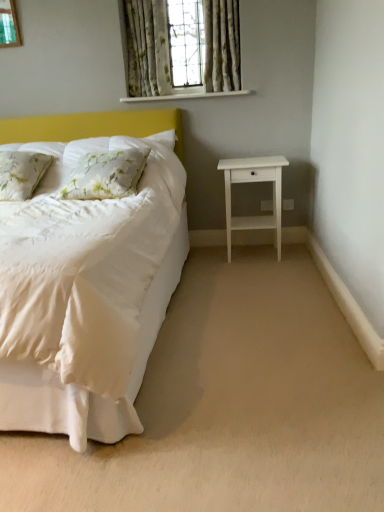
Question: Does floral fabric pillow at left, the first pillow positioned from the left, have a greater height compared to floral fabric pillow at left, marked as the second pillow in a left-to-right arrangement?

Choices:
 (A) no
 (B) yes

Answer: (B)

Question: From the image's perspective, is floral fabric pillow at left, marked as the 2th pillow in a right-to-left arrangement, below floral fabric pillow at left, marked as the second pillow in a left-to-right arrangement?

Choices:
 (A) no
 (B) yes

Answer: (B)

Question: Considering the relative sizes of floral fabric pillow at left, the first pillow positioned from the left, and floral fabric pillow at left, arranged as the first pillow when viewed from the right, in the image provided, is floral fabric pillow at left, the first pillow positioned from the left, thinner than floral fabric pillow at left, arranged as the first pillow when viewed from the right,?

Choices:
 (A) no
 (B) yes

Answer: (A)

Question: Is floral fabric pillow at left, arranged as the first pillow when viewed from the right, a part of floral fabric pillow at left, marked as the 2th pillow in a right-to-left arrangement?

Choices:
 (A) no
 (B) yes

Answer: (A)

Question: Does floral fabric pillow at left, marked as the 2th pillow in a right-to-left arrangement, have a greater width compared to floral fabric pillow at left, marked as the second pillow in a left-to-right arrangement?

Choices:
 (A) yes
 (B) no

Answer: (A)

Question: Considering the relative positions of floral fabric pillow at left, the first pillow positioned from the left, and floral fabric pillow at left, marked as the second pillow in a left-to-right arrangement, in the image provided, is floral fabric pillow at left, the first pillow positioned from the left, to the left of floral fabric pillow at left, marked as the second pillow in a left-to-right arrangement, from the viewer's perspective?

Choices:
 (A) no
 (B) yes

Answer: (B)

Question: Is white matte nightstand at right outside of white painted wood at upper center?

Choices:
 (A) yes
 (B) no

Answer: (A)

Question: Is white matte nightstand at right further to the viewer compared to white painted wood at upper center?

Choices:
 (A) yes
 (B) no

Answer: (B)

Question: Can you confirm if white matte nightstand at right is positioned to the right of white painted wood at upper center?

Choices:
 (A) no
 (B) yes

Answer: (B)

Question: From the image's perspective, is white matte nightstand at right beneath white painted wood at upper center?

Choices:
 (A) yes
 (B) no

Answer: (A)

Question: Considering the relative sizes of white matte nightstand at right and white painted wood at upper center in the image provided, is white matte nightstand at right smaller than white painted wood at upper center?

Choices:
 (A) yes
 (B) no

Answer: (B)

Question: Could you tell me if white matte nightstand at right is turned towards white painted wood at upper center?

Choices:
 (A) no
 (B) yes

Answer: (A)

Question: From the image's perspective, does floral fabric curtain at upper center, marked as the 1th curtain in a left-to-right arrangement, appear lower than floral fabric pillow at left, arranged as the first pillow when viewed from the right?

Choices:
 (A) yes
 (B) no

Answer: (B)